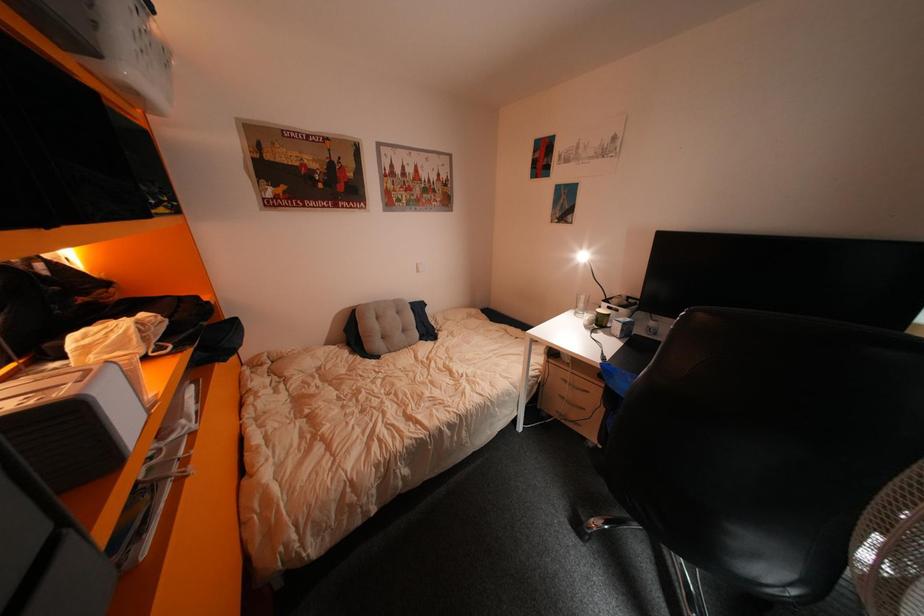
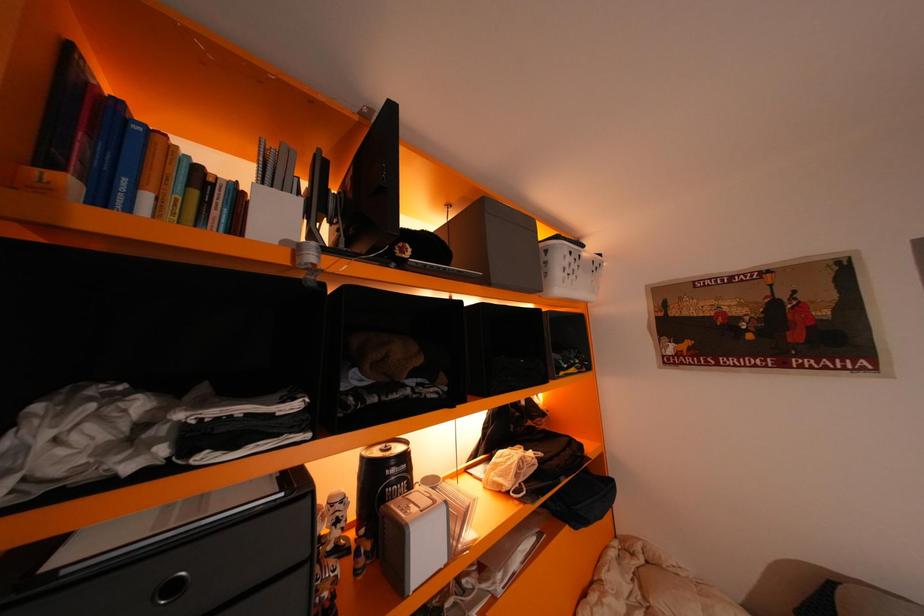
Question: The first image is from the beginning of the video and the second image is from the end. How did the camera likely rotate when shooting the video?

Choices:
 (A) Left
 (B) Right
 (C) Up
 (D) Down

Answer: (A)